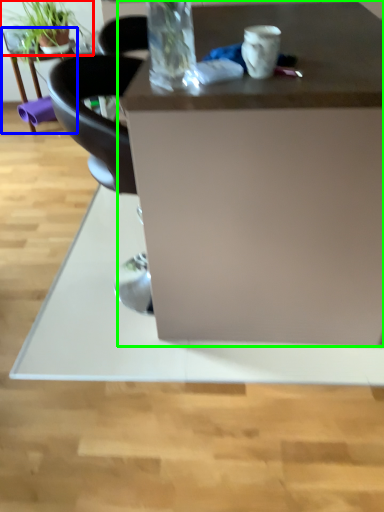
Question: Considering the real-world distances, which object is farthest from houseplant (highlighted by a red box)? table (highlighted by a blue box) or desk (highlighted by a green box)?

Choices:
 (A) table
 (B) desk

Answer: (B)